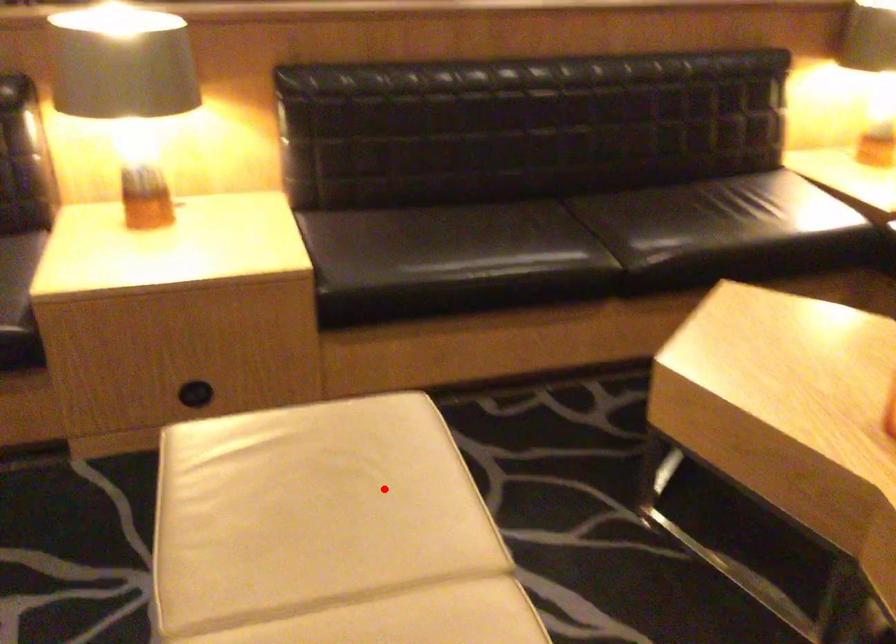
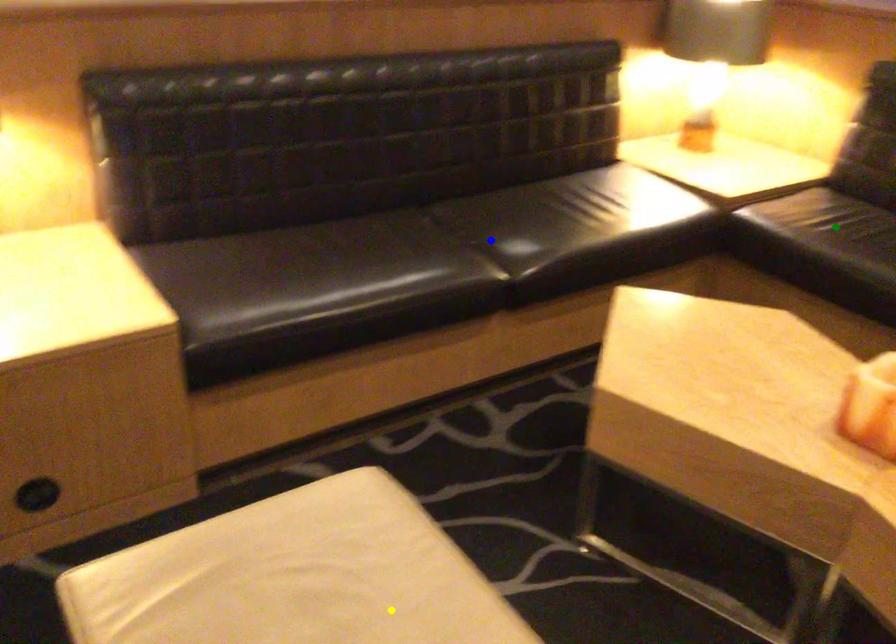
Question: I am providing you with two images of the same scene from different viewpoints. A red point is marked on the first image. You are given multiple points on the second image. Which mark in image 2 goes with the point in image 1?

Choices:
 (A) blue point
 (B) green point
 (C) yellow point

Answer: (C)